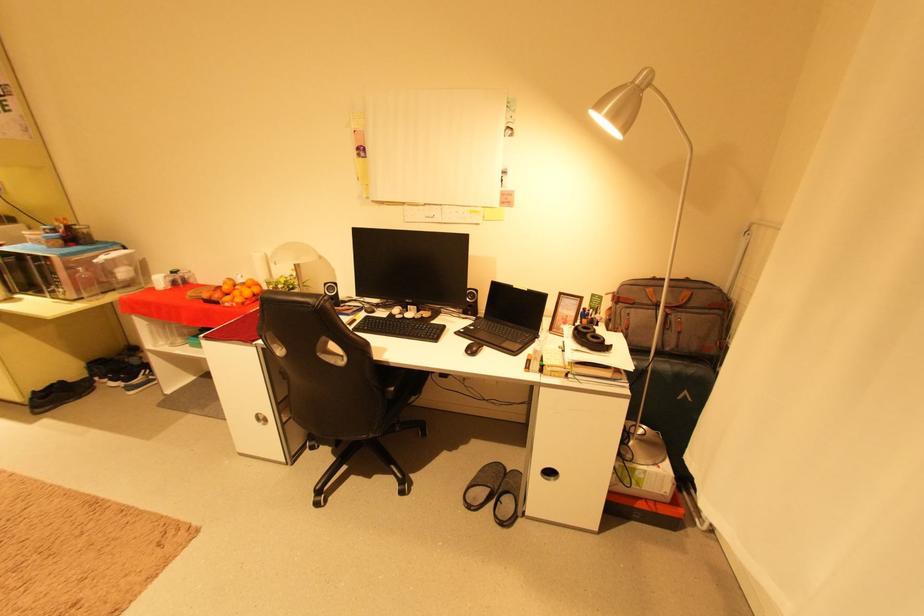
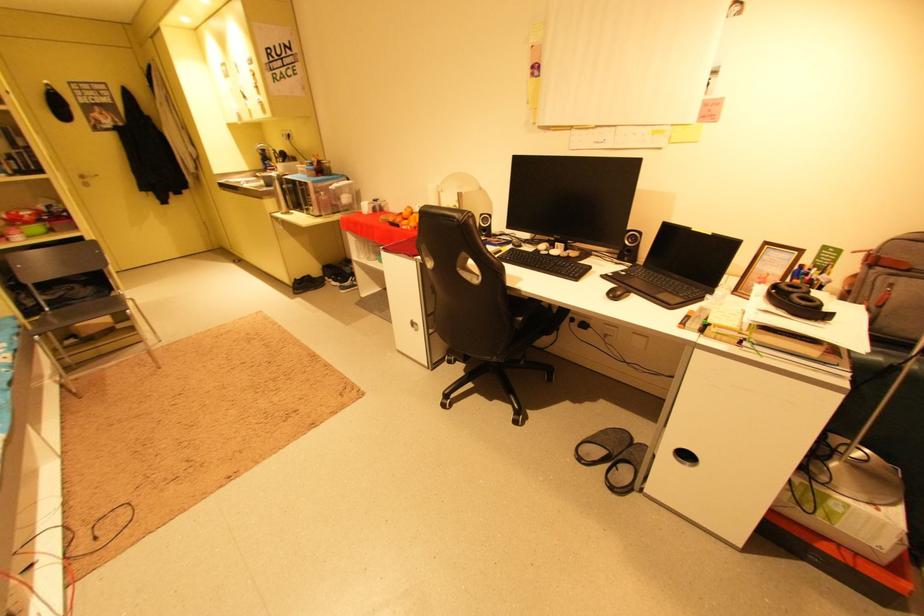
Find the pixel in the second image that matches the point at 640,305 in the first image.

(917, 272)